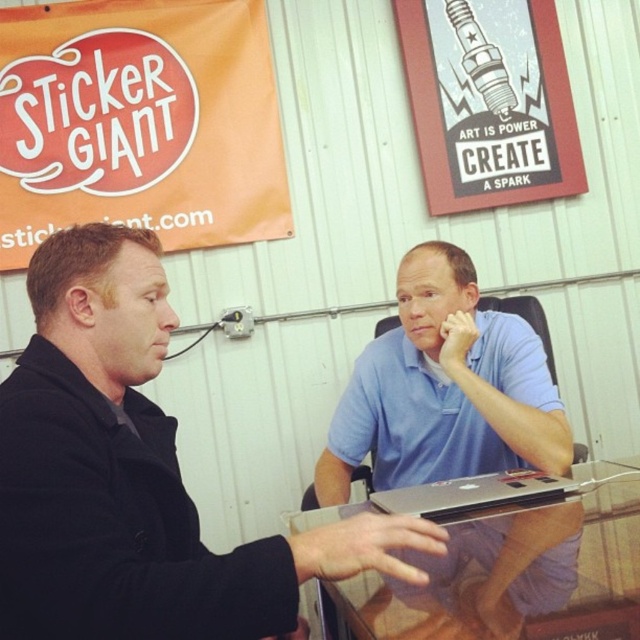
You are a photographer standing in front of the scene. You want to take a photo that includes both the black matte jacket at center and the silver metallic laptop at center. Based on their positions, which object should you focus on first to ensure both are in frame?

The black matte jacket at center is above the silver metallic laptop at center, so you should focus on the silver metallic laptop at center first to ensure both are in frame.